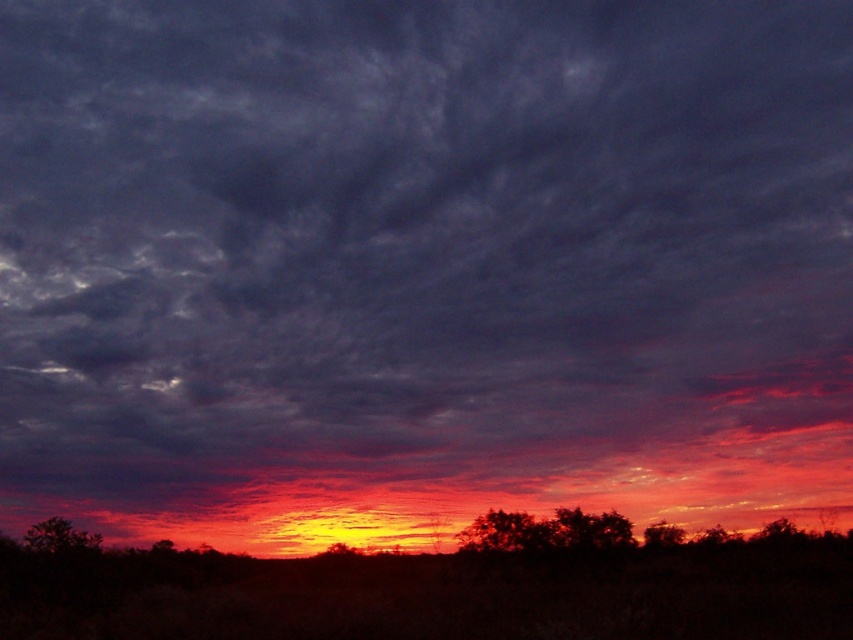
You are an artist trying to paint the sunset scene. You want to ensure the silhouette tree at center and the silhouetted tree at lower center are proportionally accurate. Which tree should you make larger in your painting?

The silhouette tree at center should be made larger in the painting since it has a larger size compared to the silhouetted tree at lower center according to the description.

You are standing in the sunset scene and want to move from the point at coordinates point (506,538) to the point at coordinates point (663,532). Which direction should you face to walk towards the second point?

Point (506,538) is closer to the viewer than point (663,532). To walk towards the second point, you should face away from the viewer, moving towards the horizon where the sun has set.

You are standing at the point marked as point [505,532] in the image. Looking around, you notice a silhouette tree at center. Which direction should you walk to reach the silhouette tree at center?

You are already at the point where the silhouette tree at center is located, so you don not need to walk anywhere else.